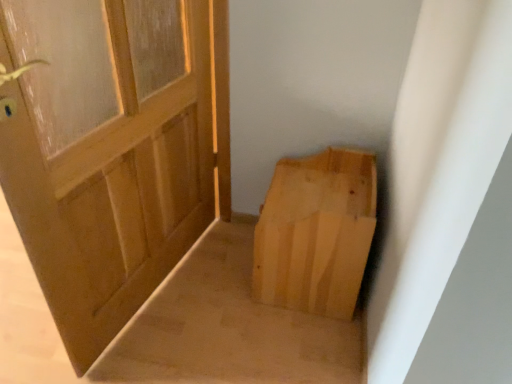
Identify the location of free location in front of natural wood cardboard box at lower right. Image resolution: width=512 pixels, height=384 pixels. coord(289,342).